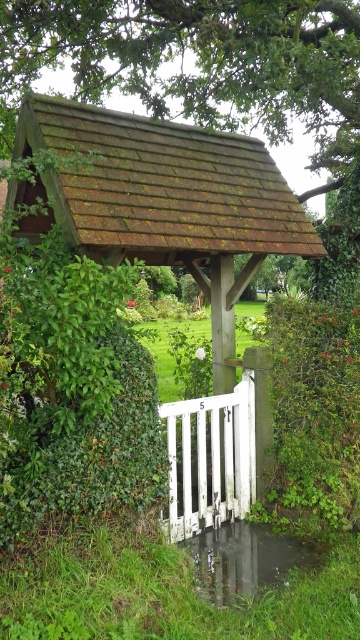
You are standing at the entrance of the lychgate and want to walk towards the gate. There are two points marked on the structure. Which point, point (x=348, y=259) or point (x=204, y=403), is closer to you as you face the gate?

Point (x=204, y=403) is closer to you because it is in front of point (x=348, y=259).